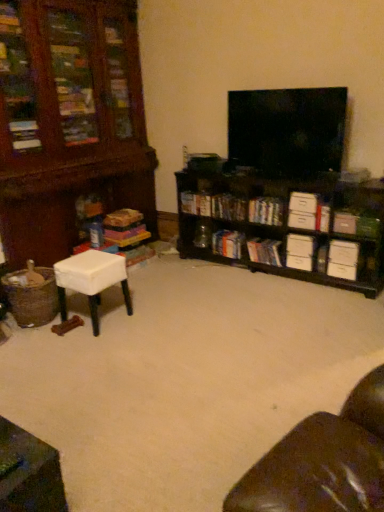
Locate an element on the screen. Image resolution: width=384 pixels, height=512 pixels. free point to the right of white fabric stool at lower left, the 2th table in the bottom-to-top sequence is located at coordinates (142, 321).